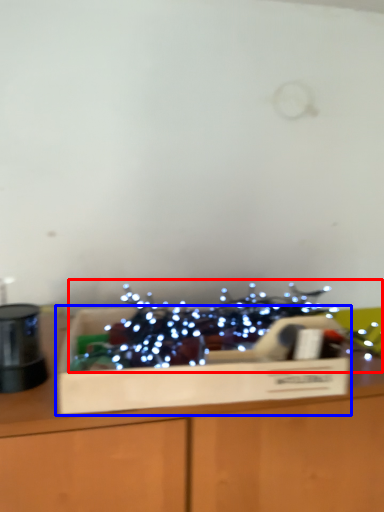
Question: Which object is closer to the camera taking this photo, christmas decoration (highlighted by a red box) or cardboard box (highlighted by a blue box)?

Choices:
 (A) christmas decoration
 (B) cardboard box

Answer: (A)